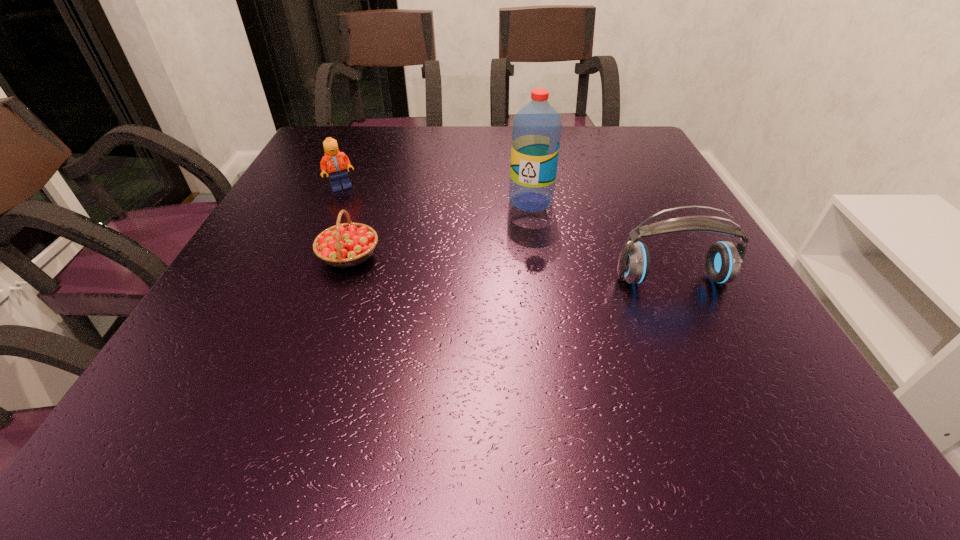
The height and width of the screenshot is (540, 960). Find the location of `vacant space on the desktop that is between the shortest object and the headset and is positioned on the front label of the tallest object`. vacant space on the desktop that is between the shortest object and the headset and is positioned on the front label of the tallest object is located at coordinates (474, 265).

The width and height of the screenshot is (960, 540). I want to click on free space on the desktop that is between the shortest object and the rightmost object and is positioned on the front-facing side of the third tallest object, so click(x=467, y=264).